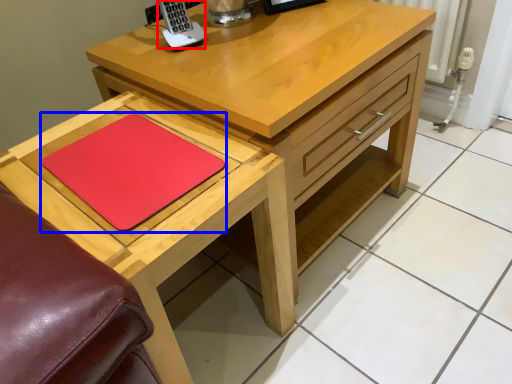
Question: Which object is further to the camera taking this photo, appliance (highlighted by a red box) or pad (highlighted by a blue box)?

Choices:
 (A) appliance
 (B) pad

Answer: (A)